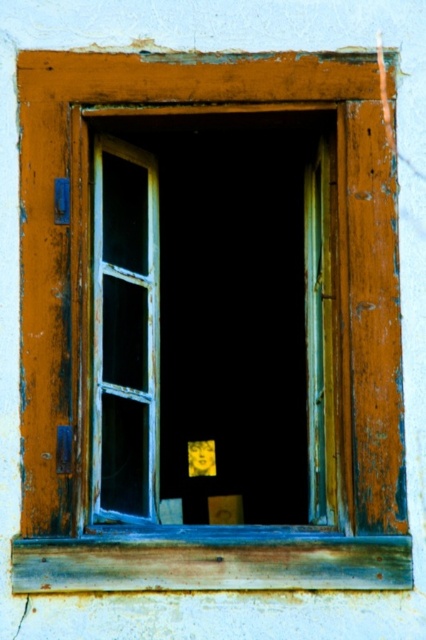
Does wooden frame window at center appear on the left side of rusty wood window sill at lower center?

Correct, you'll find wooden frame window at center to the left of rusty wood window sill at lower center.

Identify the location of wooden frame window at center. This screenshot has width=426, height=640. (213, 321).

Where is `wooden frame window at center`? The height and width of the screenshot is (640, 426). wooden frame window at center is located at coordinates (213, 321).